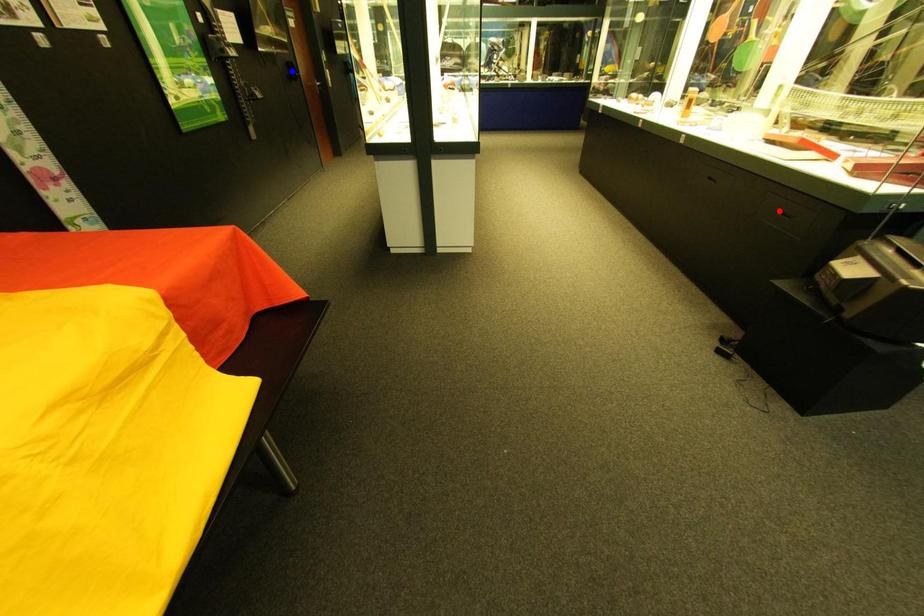
Question: In the image, two points are highlighted. Which point is nearer to the camera? Reply with the corresponding letter.

Choices:
 (A) blue point
 (B) red point

Answer: (B)